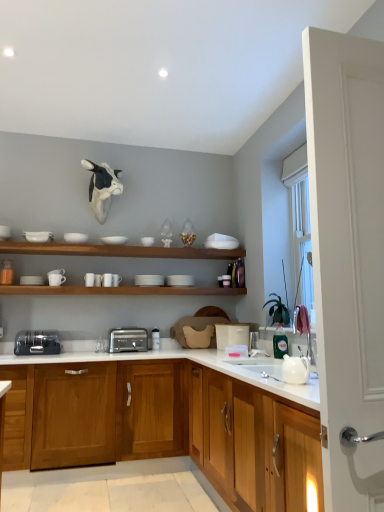
Question: Does white matte plate at center, which is counted as the 1th tableware, starting from the right, have a greater width compared to white matte cup at left, the 8th tableware viewed from the right?

Choices:
 (A) yes
 (B) no

Answer: (A)

Question: From a real-world perspective, is white matte plate at center, which is counted as the 1th tableware, starting from the right, positioned under white matte cup at left, the 8th tableware viewed from the right, based on gravity?

Choices:
 (A) no
 (B) yes

Answer: (A)

Question: From a real-world perspective, is white matte plate at center, the 8th tableware from the left, on white matte cup at left, the first tableware when ordered from left to right?

Choices:
 (A) no
 (B) yes

Answer: (B)

Question: Does white matte plate at center, which is counted as the 1th tableware, starting from the right, appear on the left side of white matte cup at left, the first tableware when ordered from left to right?

Choices:
 (A) no
 (B) yes

Answer: (A)

Question: Is there a large distance between white matte plate at center, the 8th tableware from the left, and white matte cup at left, the 8th tableware viewed from the right?

Choices:
 (A) yes
 (B) no

Answer: (A)

Question: In terms of height, does white matte bowl at upper center, which is the 4th tableware in right-to-left order, look taller or shorter compared to satin silver toaster at center, which ranks as the 2th toaster in left-to-right order?

Choices:
 (A) short
 (B) tall

Answer: (A)

Question: Does point (104, 242) appear closer or farther from the camera than point (139, 340)?

Choices:
 (A) closer
 (B) farther

Answer: (B)

Question: Based on their positions, is white matte bowl at upper center, which ranks as the fifth tableware in left-to-right order, located to the left or right of satin silver toaster at center, which ranks as the 2th toaster in left-to-right order?

Choices:
 (A) left
 (B) right

Answer: (A)

Question: From a real-world perspective, is white matte bowl at upper center, which is the 4th tableware in right-to-left order, physically located above or below satin silver toaster at center, which is the 1th toaster from right to left?

Choices:
 (A) above
 (B) below

Answer: (A)

Question: Visually, is wooden cabinet at center, the second cabinetry in the back-to-front sequence, positioned to the left or to the right of white matte cup at left, the 8th tableware viewed from the right?

Choices:
 (A) left
 (B) right

Answer: (B)

Question: From the image's perspective, is wooden cabinet at center, the second cabinetry in the back-to-front sequence, located above or below white matte cup at left, the 8th tableware viewed from the right?

Choices:
 (A) below
 (B) above

Answer: (A)

Question: In terms of size, does wooden cabinet at center, the second cabinetry in the back-to-front sequence, appear bigger or smaller than white matte cup at left, the first tableware when ordered from left to right?

Choices:
 (A) small
 (B) big

Answer: (B)

Question: In terms of width, does wooden cabinet at center, the 1th cabinetry from the front, look wider or thinner when compared to white matte cup at left, the 8th tableware viewed from the right?

Choices:
 (A) wide
 (B) thin

Answer: (A)

Question: Would you say wooden cabinet at center, the second cabinetry in the back-to-front sequence, is to the left or to the right of white matte shelves at upper center, the 1th shelf in the top-to-bottom sequence, in the picture?

Choices:
 (A) left
 (B) right

Answer: (B)

Question: Looking at the image, does wooden cabinet at center, the 1th cabinetry from the front, seem bigger or smaller compared to white matte shelves at upper center, the 1th shelf in the top-to-bottom sequence?

Choices:
 (A) small
 (B) big

Answer: (B)